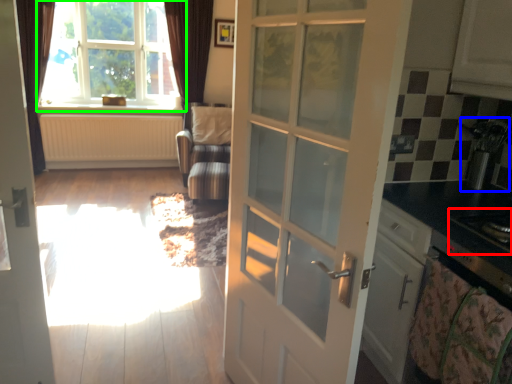
Question: Which is nearer to the appliance (highlighted by a red box)? appliance (highlighted by a blue box) or window (highlighted by a green box).

Choices:
 (A) appliance
 (B) window

Answer: (A)